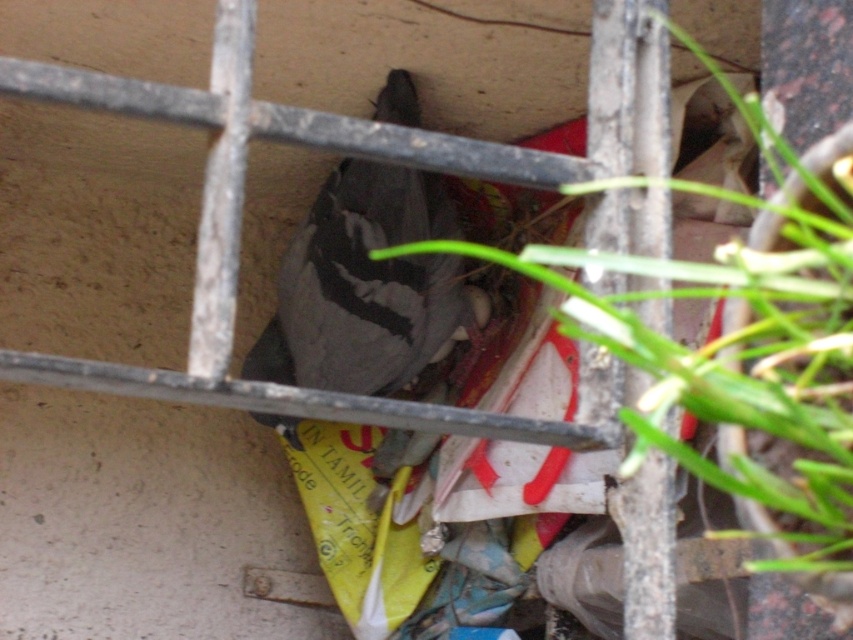
You are a drone operator trying to capture a clear image of the pigeon in the enclosed space. You need to adjust your camera focus to either the point at (784, 316) or the point at (326, 225). Which point should you focus on to get a clearer image of the pigeon?

You should focus on point (784, 316) because it is closer to the viewer than point (326, 225), so it will be in clearer focus.

You are a gardener trying to identify plants in a cluttered space. You notice a green leafy plant at center and a gray matte bird at center. Which object takes up more horizontal space in the image?

The green leafy plant at center has a larger width than the gray matte bird at center, so it takes up more horizontal space in the image.

You are a gardener trying to reach the green leafy plant at center and the gray matte bird at center in the enclosed space. Since the space is small, you need to know which one is bigger to prioritize. Which object is larger?

The green leafy plant at center is larger than the gray matte bird at center, so you should prioritize the plant first.